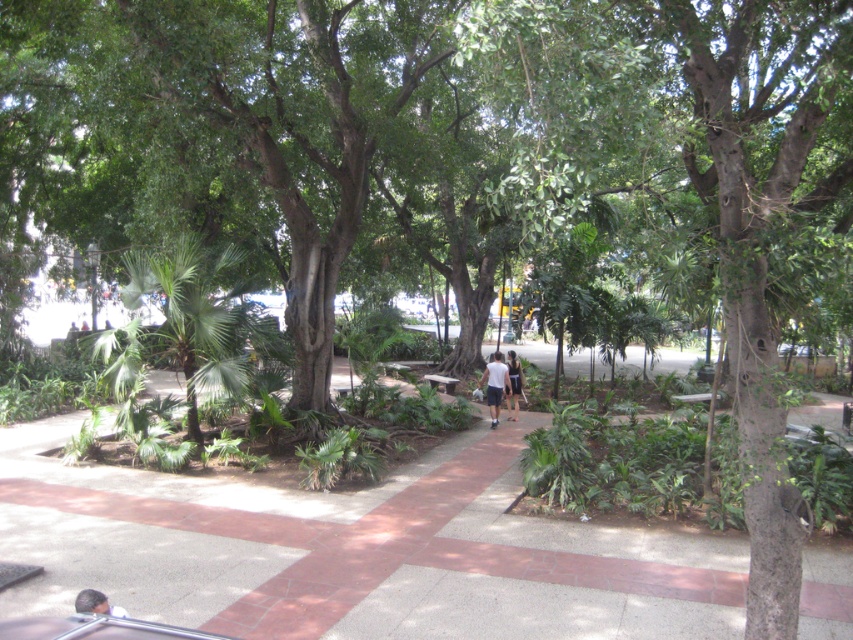
You are standing on the pathway and see the white cotton couple at center and the white fabric shorts at center. Which one is closer to you?

The white cotton couple at center is closer to you because it is in front of the white fabric shorts at center.

You are a photographer trying to capture a candid shot of the white cotton couple at center and the white fabric shorts at center. From your current position, which of the two subjects is located to the left?

The white cotton couple at center is positioned on the left side of the white fabric shorts at center, so the white cotton couple at center is located to the left.

From the picture: You are a photographer trying to capture a shot of the dark brown hair at lower left and the wooden park bench at center. Which object should you focus on first if you want to include both in your frame without moving the camera?

The dark brown hair at lower left is not as tall as the wooden park bench at center, so you should focus on the wooden park bench at center first to ensure both are in frame.